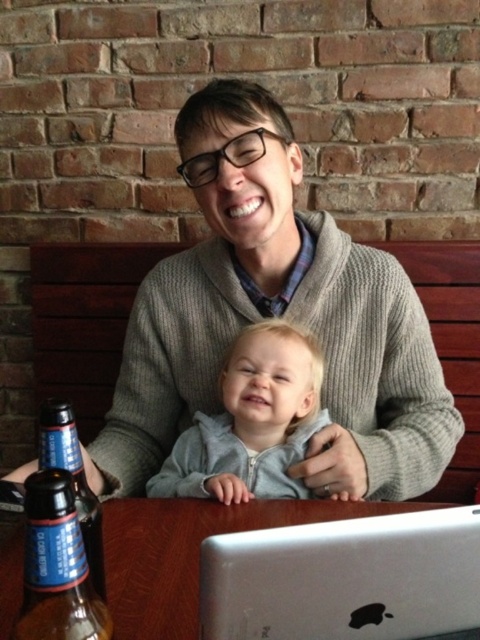
You have a 20 inch long ruler. You want to measure the distance between the gray knitted sweater at center and the brown glass bottle at lower left. Will the ruler be sufficient to measure the distance?

The gray knitted sweater at center and brown glass bottle at lower left are 19.80 inches apart. Since the ruler is 20 inches long, it will be sufficient to measure the distance between them.

You are a barista at the cafe and need to reach for the brown glass bottle at lower left to refill a customer drink. Can you easily access it without moving the clear glass bottle at lower left?

The clear glass bottle at lower left is located above the brown glass bottle at lower left, so the brown glass bottle at lower left is underneath. Since it is below the clear bottle, you can access it by moving the clear glass bottle out of the way first.